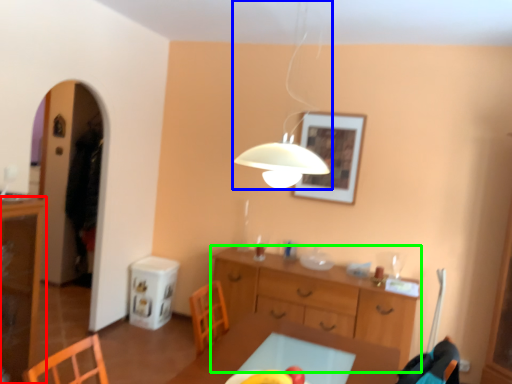
Question: Considering the real-world distances, which object is closest to cabinetry (highlighted by a red box)? lamp (highlighted by a blue box) or desk (highlighted by a green box).

Choices:
 (A) lamp
 (B) desk

Answer: (B)